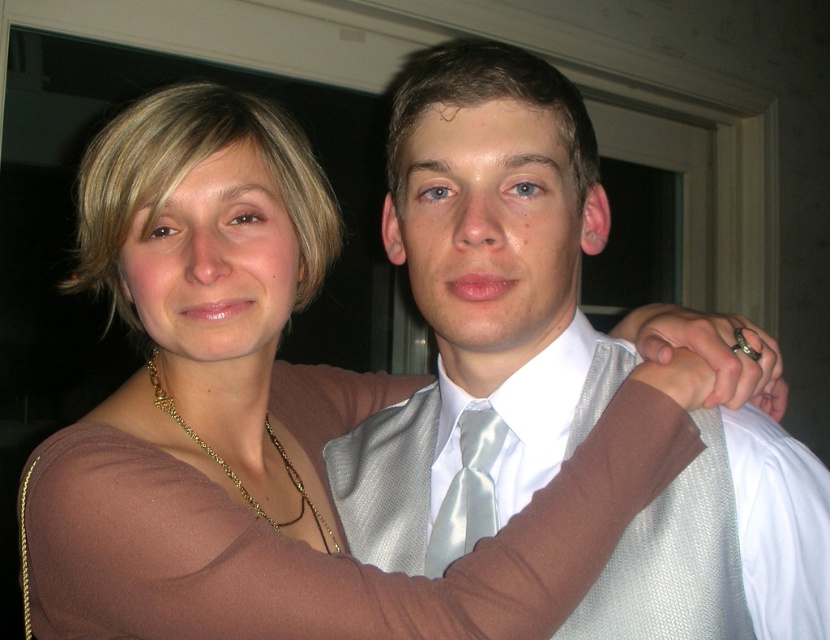
You are a photographer adjusting the lighting in a studio. You notice the satin white vest at center and the satin light blue tie at center. Which one should you focus your spotlight on to highlight the upper part of the outfit?

The satin white vest at center is above the satin light blue tie at center, so you should focus the spotlight on the satin white vest at center to highlight the upper part of the outfit.

You are a photographer adjusting the lighting for a portrait. You need to ensure that the satin light blue tie at center and the gold chain necklace at center are both clearly visible. Which one requires more downward lighting adjustment to avoid shadows?

The satin light blue tie at center is shorter than the gold chain necklace at center, so the gold chain necklace at center requires more downward lighting adjustment to avoid shadows since it is taller and might cast longer shadows.